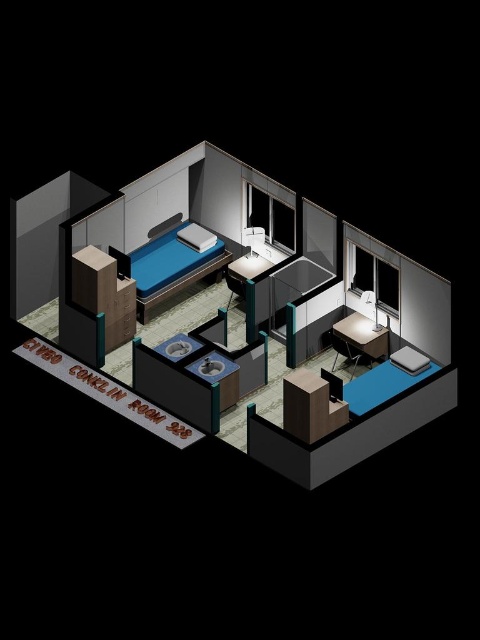
Question: Which object is the farthest from the wooden desk at center?

Choices:
 (A) matte black desk at center
 (B) wooden cabinet at lower left

Answer: (B)

Question: Which object appears farthest from the camera in this image?

Choices:
 (A) wooden cabinet at lower left
 (B) wooden desk at center
 (C) matte blue bed at center
 (D) matte black desk at center

Answer: (C)

Question: From the image, what is the correct spatial relationship of wooden desk at center in relation to matte black desk at center?

Choices:
 (A) below
 (B) above

Answer: (A)

Question: Does matte blue bed at center appear on the left side of matte black desk at center?

Choices:
 (A) no
 (B) yes

Answer: (B)

Question: Which object is closer to the camera taking this photo?

Choices:
 (A) wooden desk at center
 (B) wooden cabinet at lower left
 (C) matte black desk at center

Answer: (A)

Question: Does wooden desk at center have a greater width compared to matte black desk at center?

Choices:
 (A) yes
 (B) no

Answer: (A)